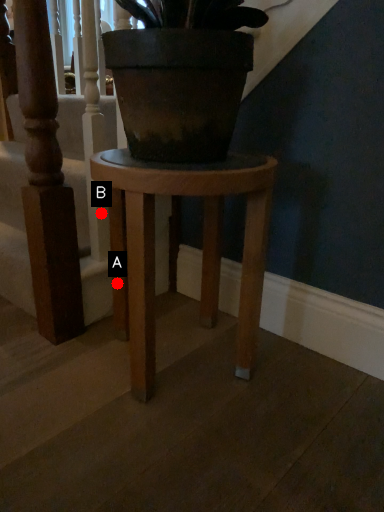
Question: Two points are circled on the image, labeled by A and B beside each circle. Which point is farther to the camera?

Choices:
 (A) A is further
 (B) B is further

Answer: (B)